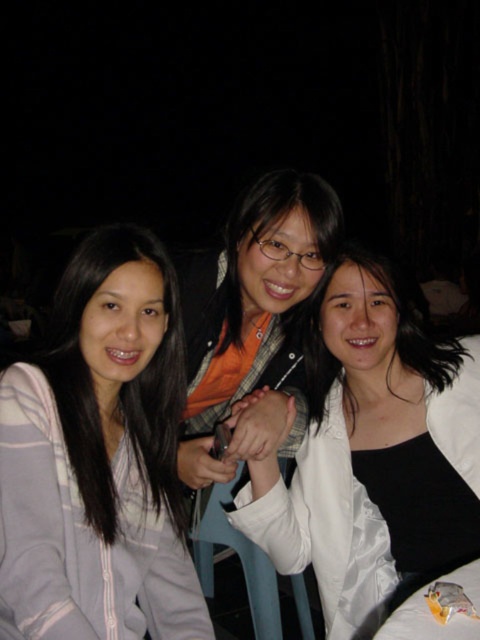
You are a photographer trying to adjust the lighting for a portrait. You notice the light gray cotton jacket at left and the white satin blouse at center. Which clothing item would require more fill light to reduce shadows, based on their thickness?

The light gray cotton jacket at left is thinner than the white satin blouse at center, so the thinner jacket may cast sharper shadows and thus require more fill light to reduce shadows.

You are a photographer trying to adjust the focus of your camera. You have two points in the image that you need to focus on. The first point is point (19, 627) and the second is point (284, 572). Which point should you focus on first to ensure the closest subject is sharp?

You should focus on point (19, 627) first because it is closer to the viewer than point (284, 572), ensuring the closest subject is in sharp focus.

You are a photographer trying to adjust the lighting for a night portrait. You notice the light gray cotton jacket at left and the white satin blouse at center. Which clothing item should you focus your spotlight on to ensure it reflects more light, and why?

The white satin blouse at center should be focused on because white color reflects more light than the light gray cotton jacket at left.